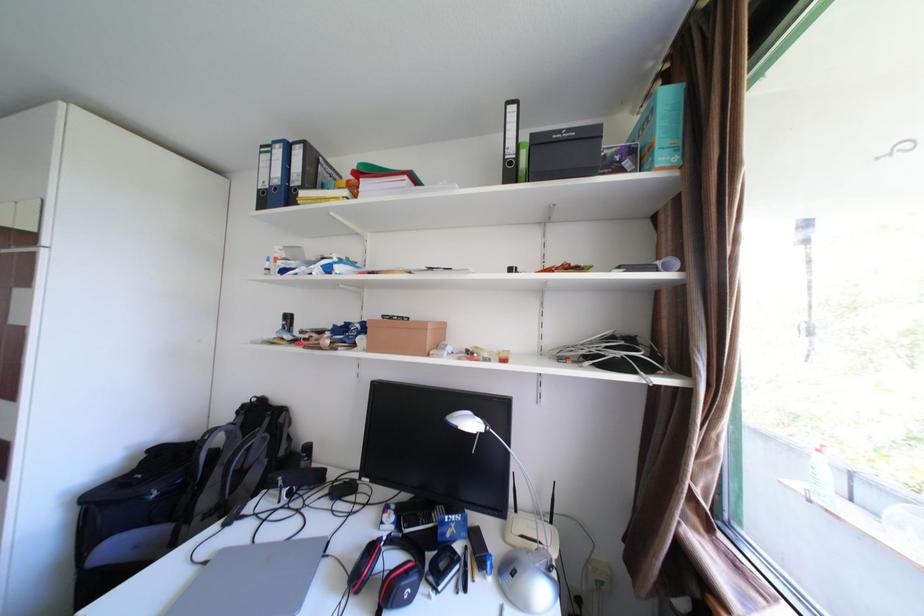
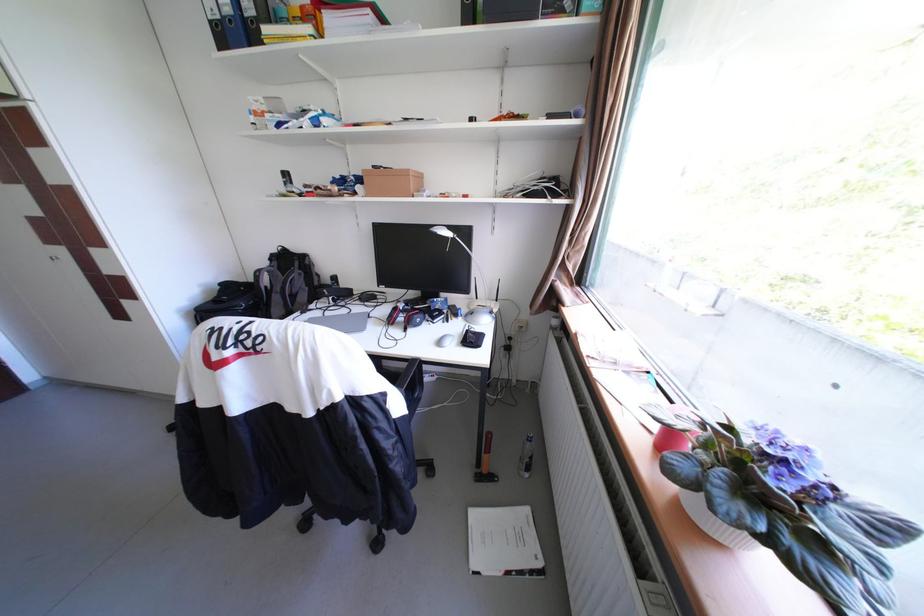
Question: The images are taken continuously from a first-person perspective. In which direction are you moving?

Choices:
 (A) Left
 (B) Right
 (C) Forward
 (D) Backward

Answer: (D)